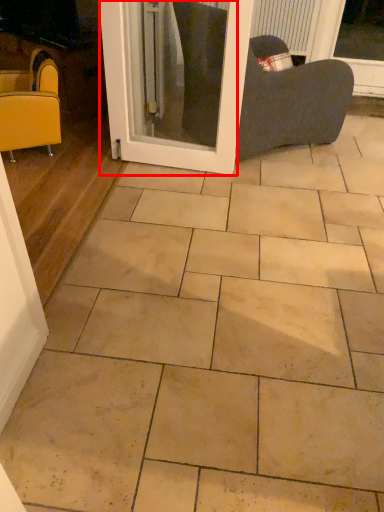
Question: Where is screen door (annotated by the red box) located in relation to chair in the image?

Choices:
 (A) right
 (B) left

Answer: (A)